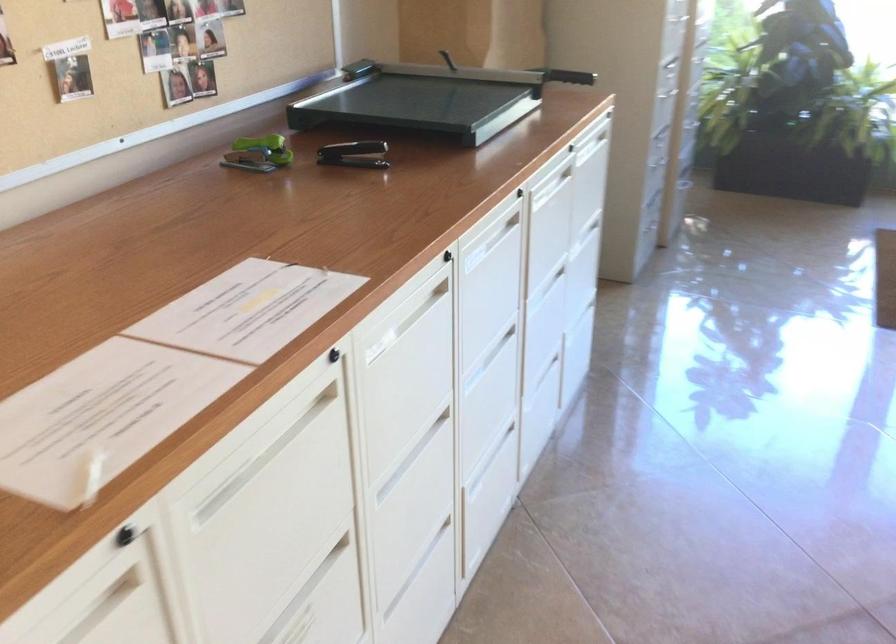
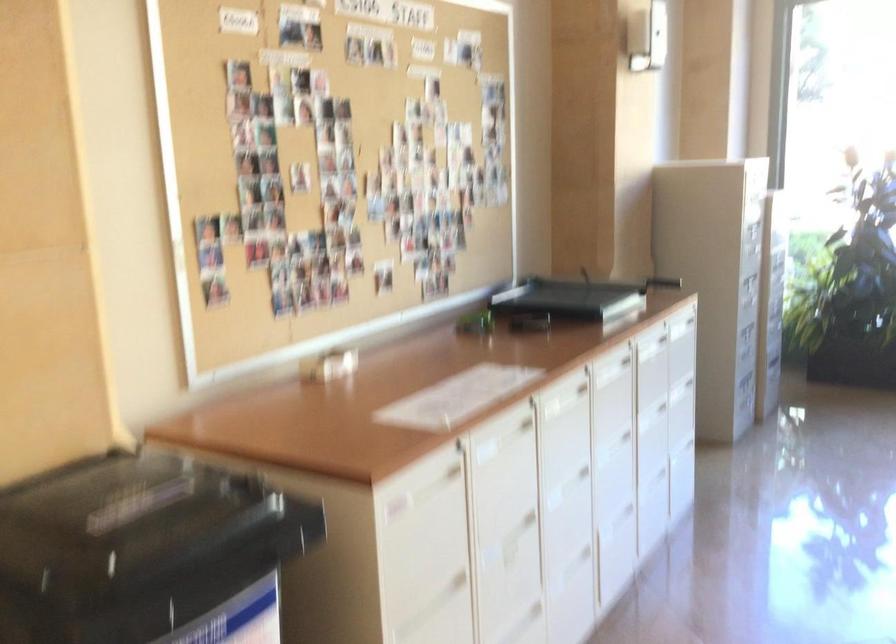
The point at (472, 266) is marked in the first image. Where is the corresponding point in the second image?

(605, 379)